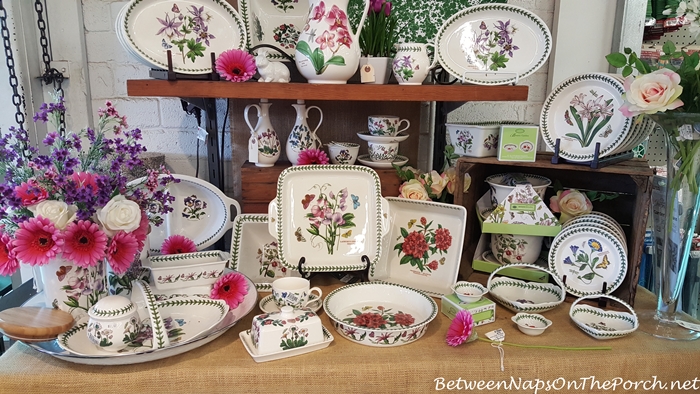
I want to click on beige table cloth, so click(x=355, y=370).